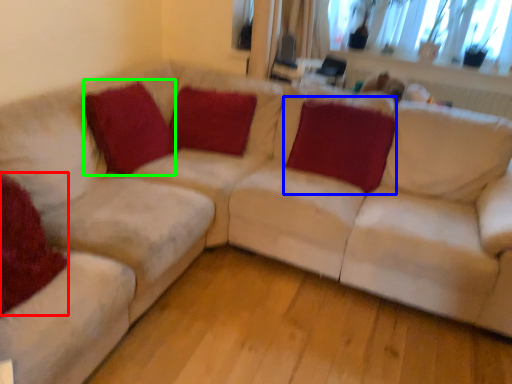
Question: Which object is positioned farthest from pillow (highlighted by a red box)? Select from pillow (highlighted by a blue box) and pillow (highlighted by a green box).

Choices:
 (A) pillow
 (B) pillow

Answer: (A)